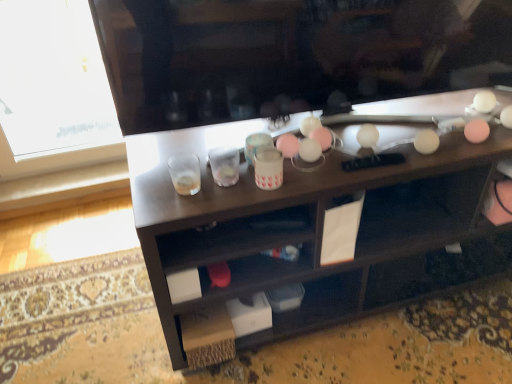
Question: Is clear plastic shot glass at center, the 1th shot glass from the right, at the back of wooden desk at center?

Choices:
 (A) no
 (B) yes

Answer: (A)

Question: Does wooden desk at center have a lesser height compared to clear plastic shot glass at center, the 1th shot glass from the right?

Choices:
 (A) no
 (B) yes

Answer: (A)

Question: Are wooden desk at center and clear plastic shot glass at center, which is counted as the 2th shot glass, starting from the left, far apart?

Choices:
 (A) no
 (B) yes

Answer: (A)

Question: From a real-world perspective, does wooden desk at center stand above clear plastic shot glass at center, the 1th shot glass from the right?

Choices:
 (A) no
 (B) yes

Answer: (A)

Question: Does wooden desk at center appear on the left side of clear plastic shot glass at center, the 1th shot glass from the right?

Choices:
 (A) no
 (B) yes

Answer: (A)

Question: Does wooden desk at center have a larger size compared to clear plastic shot glass at center, which is counted as the 2th shot glass, starting from the left?

Choices:
 (A) yes
 (B) no

Answer: (A)

Question: Is pink matte cup at center surrounding wooden desk at center?

Choices:
 (A) no
 (B) yes

Answer: (A)

Question: Is pink matte cup at center positioned in front of wooden desk at center?

Choices:
 (A) no
 (B) yes

Answer: (A)

Question: Does pink matte cup at center have a lesser width compared to wooden desk at center?

Choices:
 (A) yes
 (B) no

Answer: (A)

Question: Is pink matte cup at center to the left of wooden desk at center from the viewer's perspective?

Choices:
 (A) yes
 (B) no

Answer: (A)

Question: Can you confirm if pink matte cup at center is taller than wooden desk at center?

Choices:
 (A) yes
 (B) no

Answer: (B)

Question: Is pink matte cup at center facing away from wooden desk at center?

Choices:
 (A) yes
 (B) no

Answer: (B)

Question: From the image's perspective, would you say translucent glass at center, which ranks as the second shot glass in right-to-left order, is shown under pink matte cup at center?

Choices:
 (A) no
 (B) yes

Answer: (B)